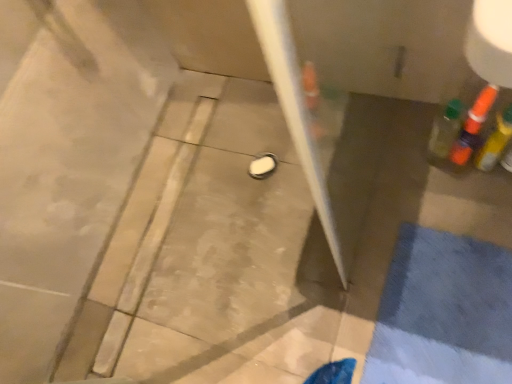
Question: From the image's perspective, is translucent plastic bottle at right, which is counted as the first bottle, starting from the left, over translucent orange bottle at upper right, placed as the 2th bottle when sorted from left to right?

Choices:
 (A) yes
 (B) no

Answer: (B)

Question: Is translucent plastic bottle at right, which is counted as the first bottle, starting from the left, not within translucent orange bottle at upper right, the second bottle when ordered from right to left?

Choices:
 (A) yes
 (B) no

Answer: (A)

Question: From the image's perspective, is translucent plastic bottle at right, which is counted as the first bottle, starting from the left, located beneath translucent orange bottle at upper right, placed as the 2th bottle when sorted from left to right?

Choices:
 (A) yes
 (B) no

Answer: (A)

Question: From a real-world perspective, is translucent plastic bottle at right, the third bottle positioned from the right, positioned over translucent orange bottle at upper right, placed as the 2th bottle when sorted from left to right, based on gravity?

Choices:
 (A) yes
 (B) no

Answer: (A)

Question: Can you confirm if translucent plastic bottle at right, the third bottle positioned from the right, is shorter than translucent orange bottle at upper right, the second bottle when ordered from right to left?

Choices:
 (A) no
 (B) yes

Answer: (B)

Question: Is translucent plastic bottle at right, the third bottle positioned from the right, taller or shorter than translucent orange bottle at right, which appears as the 1th bottle when viewed from the right?

Choices:
 (A) short
 (B) tall

Answer: (B)

Question: In the image, is translucent plastic bottle at right, the third bottle positioned from the right, on the left side or the right side of translucent orange bottle at right, arranged as the 3th bottle when viewed from the left?

Choices:
 (A) left
 (B) right

Answer: (A)

Question: Is translucent plastic bottle at right, the third bottle positioned from the right, situated inside translucent orange bottle at right, arranged as the 3th bottle when viewed from the left, or outside?

Choices:
 (A) outside
 (B) inside

Answer: (A)

Question: Considering the positions of point (459, 114) and point (506, 124), is point (459, 114) closer or farther from the camera than point (506, 124)?

Choices:
 (A) farther
 (B) closer

Answer: (B)

Question: Is point (483, 147) closer or farther from the camera than point (448, 150)?

Choices:
 (A) farther
 (B) closer

Answer: (B)

Question: In terms of height, does translucent orange bottle at right, which appears as the 1th bottle when viewed from the right, look taller or shorter compared to translucent plastic bottle at right, the third bottle positioned from the right?

Choices:
 (A) short
 (B) tall

Answer: (A)

Question: In terms of size, does translucent orange bottle at right, arranged as the 3th bottle when viewed from the left, appear bigger or smaller than translucent plastic bottle at right, which is counted as the first bottle, starting from the left?

Choices:
 (A) big
 (B) small

Answer: (A)

Question: Is translucent orange bottle at right, which appears as the 1th bottle when viewed from the right, in front of or behind translucent plastic bottle at right, which is counted as the first bottle, starting from the left, in the image?

Choices:
 (A) front
 (B) behind

Answer: (A)

Question: Do you think translucent orange bottle at upper right, placed as the 2th bottle when sorted from left to right, is within translucent plastic bottle at right, which is counted as the first bottle, starting from the left, or outside of it?

Choices:
 (A) outside
 (B) inside

Answer: (A)

Question: Considering the positions of translucent orange bottle at upper right, placed as the 2th bottle when sorted from left to right, and translucent plastic bottle at right, the third bottle positioned from the right, in the image, is translucent orange bottle at upper right, placed as the 2th bottle when sorted from left to right, taller or shorter than translucent plastic bottle at right, the third bottle positioned from the right,?

Choices:
 (A) tall
 (B) short

Answer: (A)